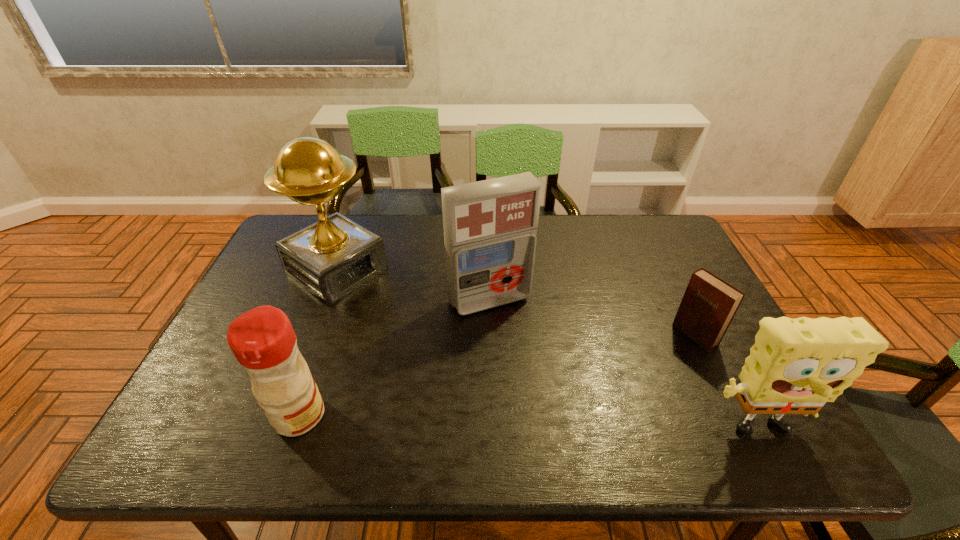
Locate an element on the screen. free space on the desktop that is between the condiment and the sponge and is positioned on the front-facing side of the second tallest object is located at coordinates (561, 425).

Identify the location of free space on the desktop that is between the condiment and the sponge and is positioned on the front cover of the shortest object. This screenshot has height=540, width=960. (554, 424).

Where is `vacant spot on the desktop that is between the condiment and the sponge and is positioned on the front-facing side of the award`? vacant spot on the desktop that is between the condiment and the sponge and is positioned on the front-facing side of the award is located at coordinates (562, 425).